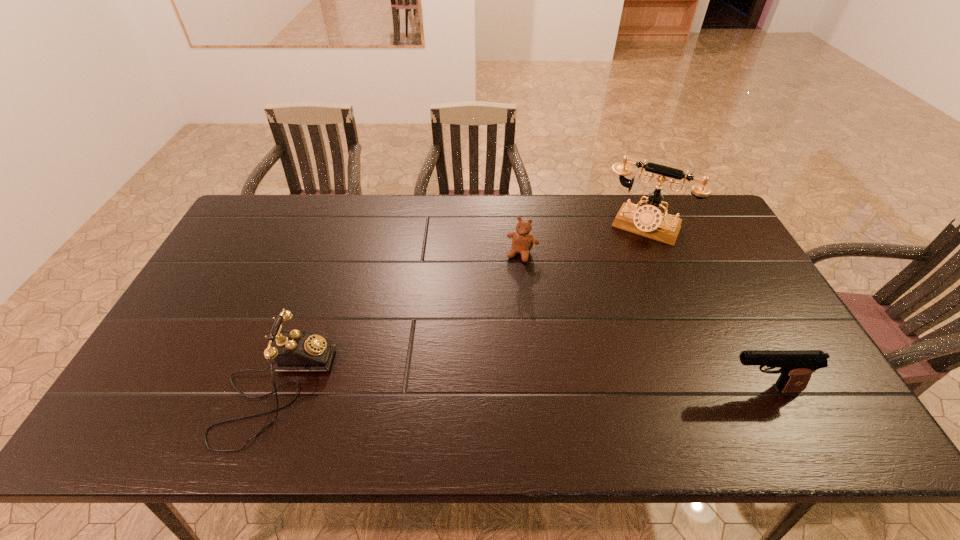
I want to click on the left telephone, so click(x=293, y=351).

The width and height of the screenshot is (960, 540). Find the location of `the leftmost object`. the leftmost object is located at coordinates (293, 351).

Where is `pistol`? pistol is located at coordinates (796, 367).

You are a GUI agent. You are given a task and a screenshot of the screen. Output one action in this format:
    pyautogui.click(x=<x>, y=<y>)
    Task: Click on the teddy bear
    This screenshot has width=960, height=540.
    Given the screenshot: What is the action you would take?
    pyautogui.click(x=522, y=242)

Locate an element on the screen. This screenshot has height=540, width=960. the taller telephone is located at coordinates (648, 220).

This screenshot has height=540, width=960. What are the coordinates of `the tallest object` in the screenshot? It's located at (648, 220).

Find the location of a particular element. The width and height of the screenshot is (960, 540). free location located 0.260m on the dial of the shorter telephone is located at coordinates (434, 390).

Find the location of a particular element. free space located 0.310m at the barrel of the pistol is located at coordinates (591, 389).

The width and height of the screenshot is (960, 540). In order to click on vacant space located 0.200m at the barrel of the pistol in this screenshot , I will do `click(637, 389)`.

Identify the location of vacant area situated at the barrel of the pistol. (687, 389).